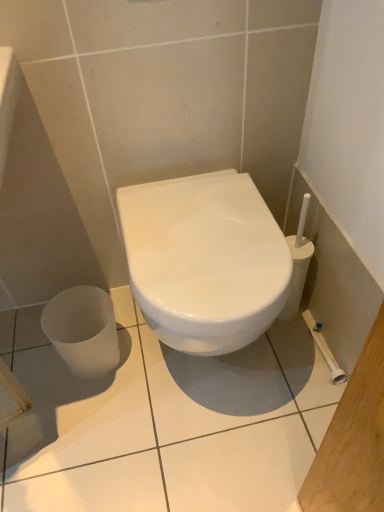
Where is `free space above white glossy toilet at center (from a real-world perspective)`? The image size is (384, 512). free space above white glossy toilet at center (from a real-world perspective) is located at coordinates (201, 224).